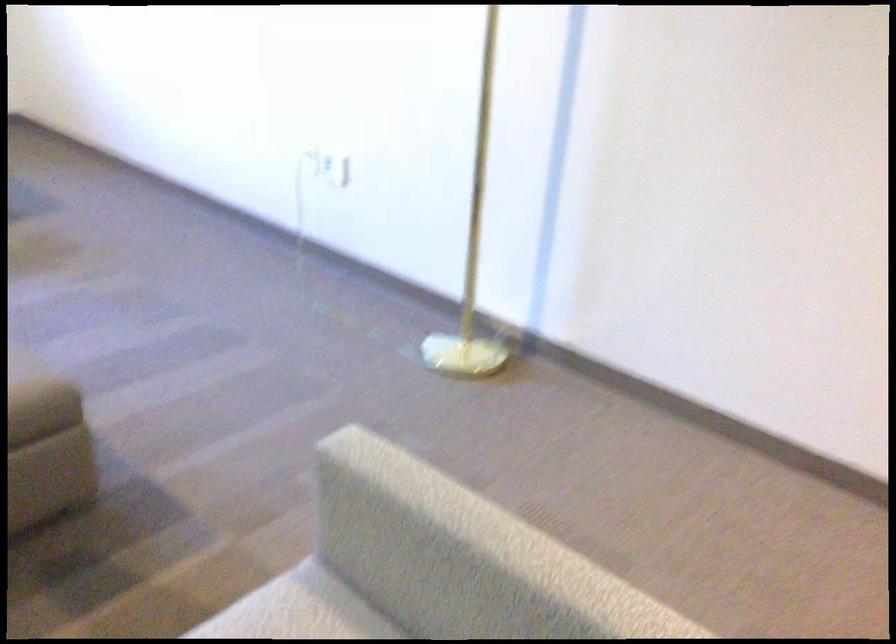
The location [471,247] corresponds to which object?

This point indicates the brass floor lamp.